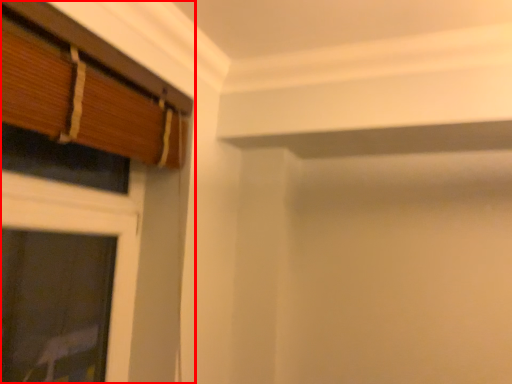
Question: From the image's perspective, considering the relative positions of window (annotated by the red box) and window in the image provided, where is window (annotated by the red box) located with respect to the staircase?

Choices:
 (A) below
 (B) above

Answer: (A)